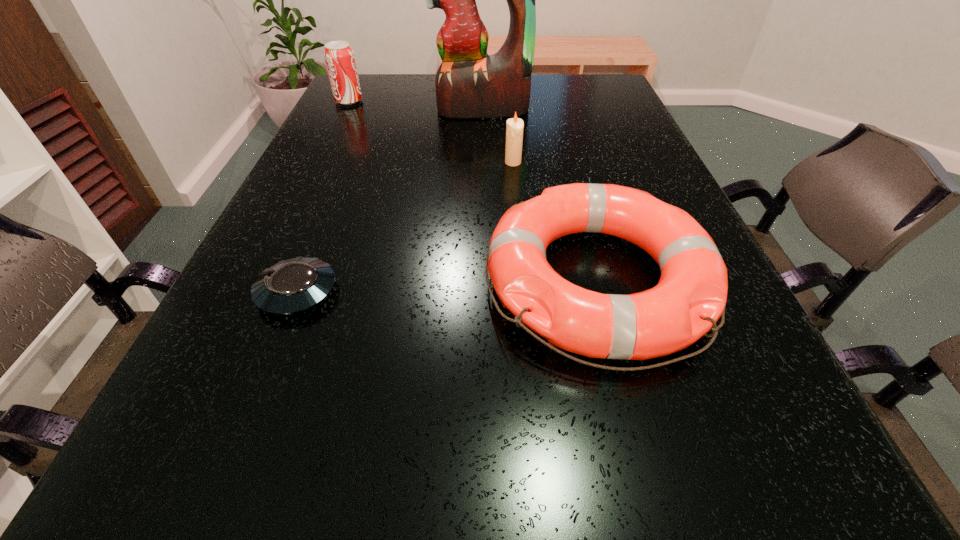
Locate an element on the screen. The width and height of the screenshot is (960, 540). vacant area between the shortest object and the parrot is located at coordinates (390, 201).

Find the location of a particular element. This screenshot has height=540, width=960. object that ranks as the fourth closest to the saucer is located at coordinates pos(339,57).

The image size is (960, 540). Find the location of `object that is the third closest to the fourth tallest object`. object that is the third closest to the fourth tallest object is located at coordinates click(x=469, y=83).

The image size is (960, 540). I want to click on vacant space that satisfies the following two spatial constraints: 1. on the logo side of the shortest object; 2. on the left side of the second tallest object, so click(254, 292).

The image size is (960, 540). Find the location of `free spot that satisfies the following two spatial constraints: 1. at the face of the third farthest object; 2. on the right side of the tallest object`. free spot that satisfies the following two spatial constraints: 1. at the face of the third farthest object; 2. on the right side of the tallest object is located at coordinates (484, 163).

You are a GUI agent. You are given a task and a screenshot of the screen. Output one action in this format:
    pyautogui.click(x=<x>, y=<y>)
    Task: Click on the blank area in the image that satisfies the following two spatial constraints: 1. at the face of the life buoy; 2. on the right side of the tallest object
    This screenshot has width=960, height=540.
    Given the screenshot: What is the action you would take?
    pyautogui.click(x=485, y=280)

The height and width of the screenshot is (540, 960). I want to click on vacant position in the image that satisfies the following two spatial constraints: 1. at the face of the second shortest object; 2. on the left side of the tallest object, so click(x=485, y=280).

Where is `free space that satisfies the following two spatial constraints: 1. on the logo side of the soda can; 2. on the left side of the third farthest object`? This screenshot has height=540, width=960. free space that satisfies the following two spatial constraints: 1. on the logo side of the soda can; 2. on the left side of the third farthest object is located at coordinates (319, 163).

This screenshot has width=960, height=540. I want to click on free space that satisfies the following two spatial constraints: 1. on the logo side of the life buoy; 2. on the left side of the second tallest object, so click(x=260, y=280).

You are a GUI agent. You are given a task and a screenshot of the screen. Output one action in this format:
    pyautogui.click(x=<x>, y=<y>)
    Task: Click on the vacant space that satisfies the following two spatial constraints: 1. on the logo side of the soda can; 2. on the back side of the life buoy
    This screenshot has height=540, width=960.
    Given the screenshot: What is the action you would take?
    pyautogui.click(x=260, y=280)